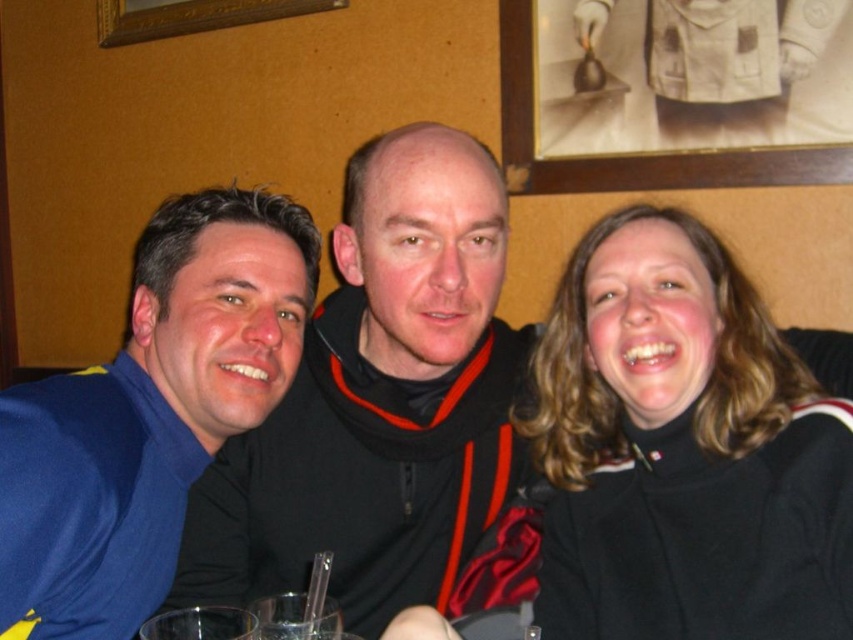
Question: Is black turtleneck sweater at right behind black matte jacket at center?

Choices:
 (A) yes
 (B) no

Answer: (B)

Question: Does black turtleneck sweater at right lie behind blue fabric shirt at left?

Choices:
 (A) no
 (B) yes

Answer: (B)

Question: Estimate the real-world distances between objects in this image. Which object is closer to the black matte jacket at center?

Choices:
 (A) blue fabric shirt at left
 (B) black turtleneck sweater at right

Answer: (A)

Question: Estimate the real-world distances between objects in this image. Which object is farther from the black turtleneck sweater at right?

Choices:
 (A) black matte jacket at center
 (B) blue fabric shirt at left

Answer: (B)

Question: Which of the following is the closest to the observer?

Choices:
 (A) (668, 371)
 (B) (352, 625)

Answer: (A)

Question: Is black turtleneck sweater at right positioned at the back of blue fabric shirt at left?

Choices:
 (A) no
 (B) yes

Answer: (B)